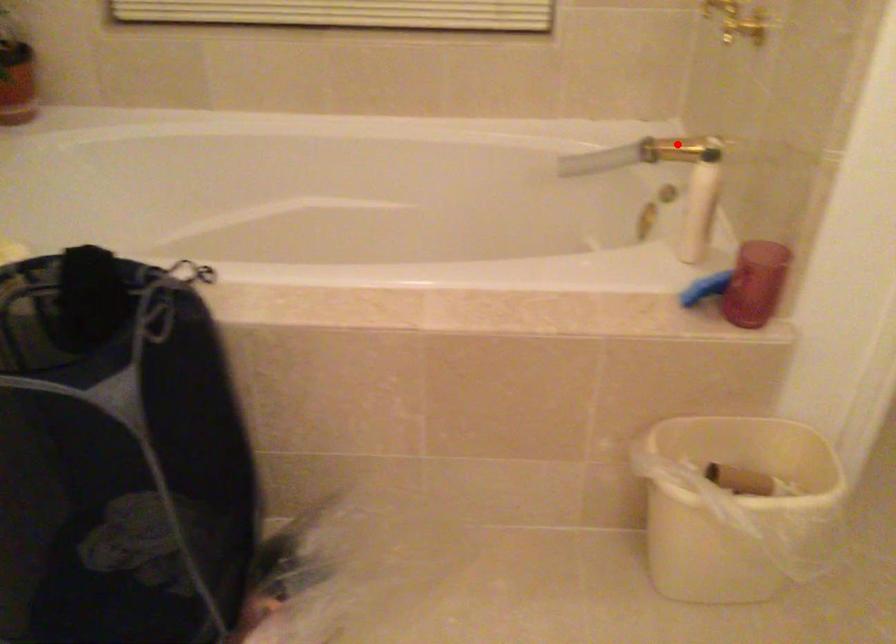
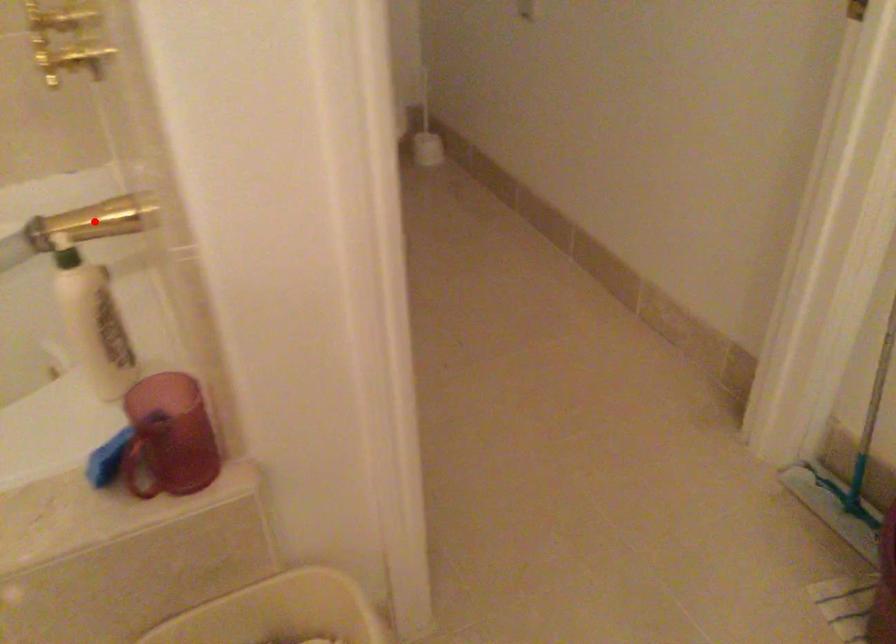
I am providing you with two images of the same scene from different viewpoints. A red point is marked on the first image and another point is marked on the second image. Is the marked point in image1 the same physical position as the marked point in image2?

Yes